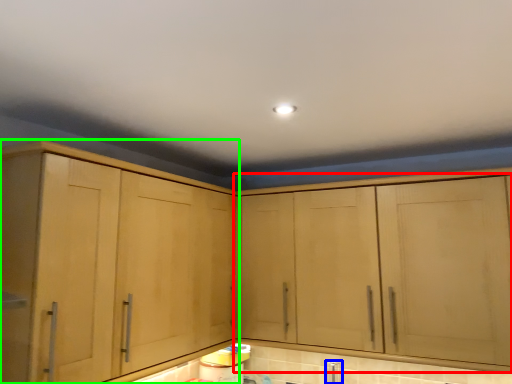
Question: Estimate the real-world distances between objects in this image. Which object is closer to cabinetry (highlighted by a red box), faucet (highlighted by a blue box) or cabinetry (highlighted by a green box)?

Choices:
 (A) faucet
 (B) cabinetry

Answer: (A)